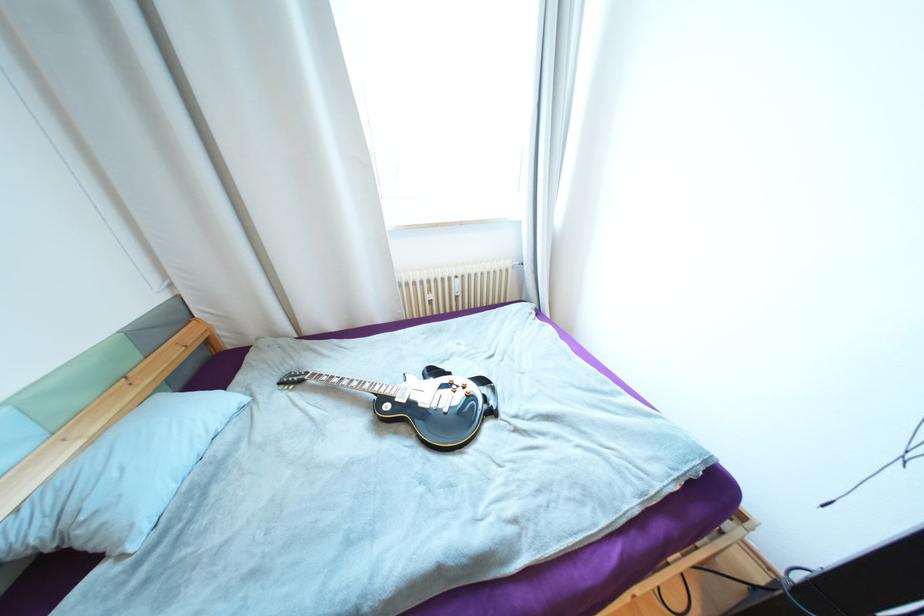
What do you see at coordinates (464, 286) in the screenshot? I see `the radiator valve` at bounding box center [464, 286].